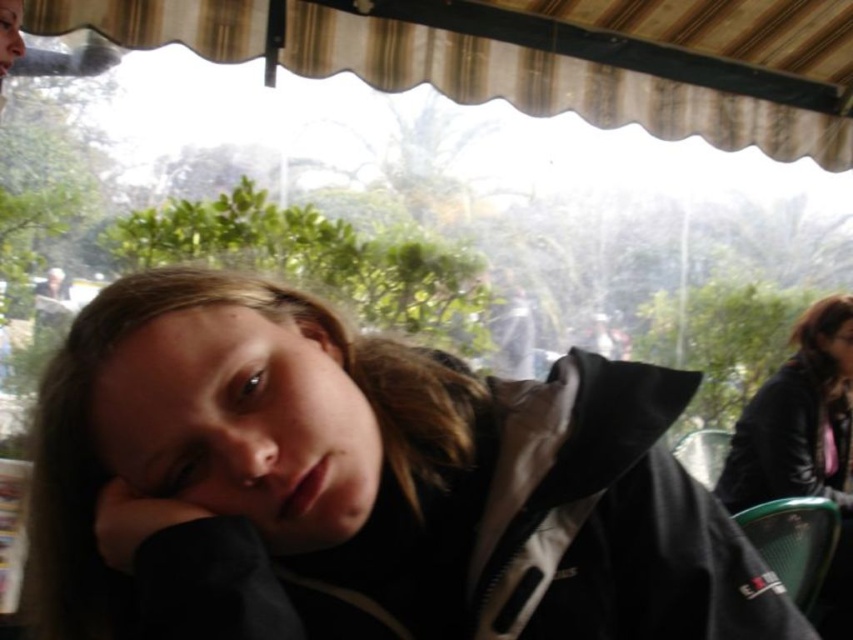
Is black matte jacket at center further to camera compared to black leather jacket at upper right?

No, it is not.

Between black matte jacket at center and black leather jacket at upper right, which one is positioned lower?

Positioned lower is black leather jacket at upper right.

Does point (183, 595) come farther from viewer compared to point (802, 356)?

No.

The height and width of the screenshot is (640, 853). Identify the location of black matte jacket at center. point(363,486).

Does black matte jacket at center have a greater height compared to beige fabric canopy at upper center?

Incorrect, black matte jacket at center's height is not larger of beige fabric canopy at upper center's.

Which is above, black matte jacket at center or beige fabric canopy at upper center?

Positioned higher is beige fabric canopy at upper center.

Does point (653, 406) lie in front of point (706, 88)?

That is True.

Where is `black matte jacket at center`? The image size is (853, 640). black matte jacket at center is located at coordinates (363, 486).

Is beige fabric canopy at upper center bigger than black leather jacket at upper right?

Indeed, beige fabric canopy at upper center has a larger size compared to black leather jacket at upper right.

Does beige fabric canopy at upper center have a smaller size compared to black leather jacket at upper right?

No.

Who is more forward, [688,90] or [807,362]?

Point [807,362] is in front.

I want to click on beige fabric canopy at upper center, so click(555, 83).